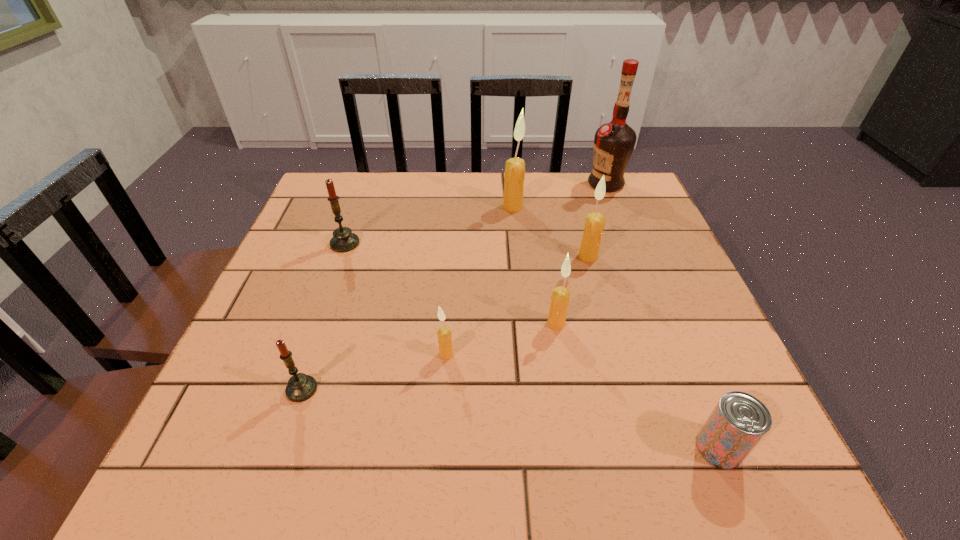
This screenshot has height=540, width=960. I want to click on free spot between the beer can and the fourth nearest object, so click(637, 386).

This screenshot has height=540, width=960. I want to click on blank region between the shortest object and the tallest candle, so click(x=615, y=327).

Locate an element on the screen. vacant area between the third nearest object and the fifth farthest object is located at coordinates (501, 339).

Find the location of `vacant space that is in between the nearest object and the second candle from right to left`. vacant space that is in between the nearest object and the second candle from right to left is located at coordinates (637, 386).

In order to click on free spot between the bigger red candle and the third nearest candle in this screenshot , I will do `click(450, 284)`.

Find the location of a particular element. This screenshot has height=540, width=960. free space between the sixth farthest object and the nearest object is located at coordinates (583, 401).

The width and height of the screenshot is (960, 540). I want to click on empty location between the nearest candle and the farther red candle, so click(324, 316).

This screenshot has height=540, width=960. Find the location of `free spot between the sixth farthest object and the biggest cream candle`. free spot between the sixth farthest object and the biggest cream candle is located at coordinates (479, 281).

In order to click on object identified as the seventh closest to the smaller red candle in this screenshot , I will do click(614, 142).

Identify the location of object that is the second closest one to the tallest object. (594, 225).